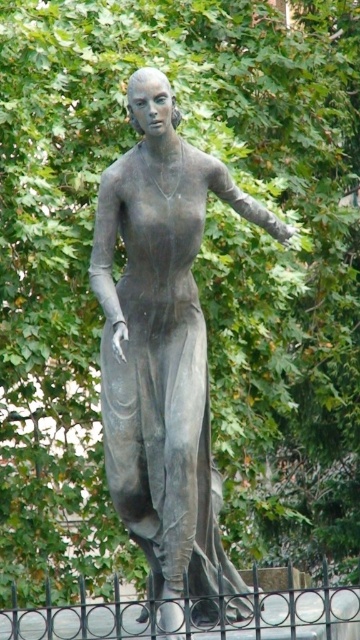
Question: Which of the following is the closest to the observer?

Choices:
 (A) (294, 628)
 (B) (189, 566)

Answer: (A)

Question: Does bronze statue at center lie in front of black wrought iron fence at lower center?

Choices:
 (A) yes
 (B) no

Answer: (B)

Question: Which point is farther from the camera taking this photo?

Choices:
 (A) (164, 504)
 (B) (340, 589)

Answer: (B)

Question: Is bronze statue at center above black wrought iron fence at lower center?

Choices:
 (A) yes
 (B) no

Answer: (A)

Question: Considering the relative positions of bronze statue at center and black wrought iron fence at lower center in the image provided, where is bronze statue at center located with respect to black wrought iron fence at lower center?

Choices:
 (A) below
 (B) above

Answer: (B)